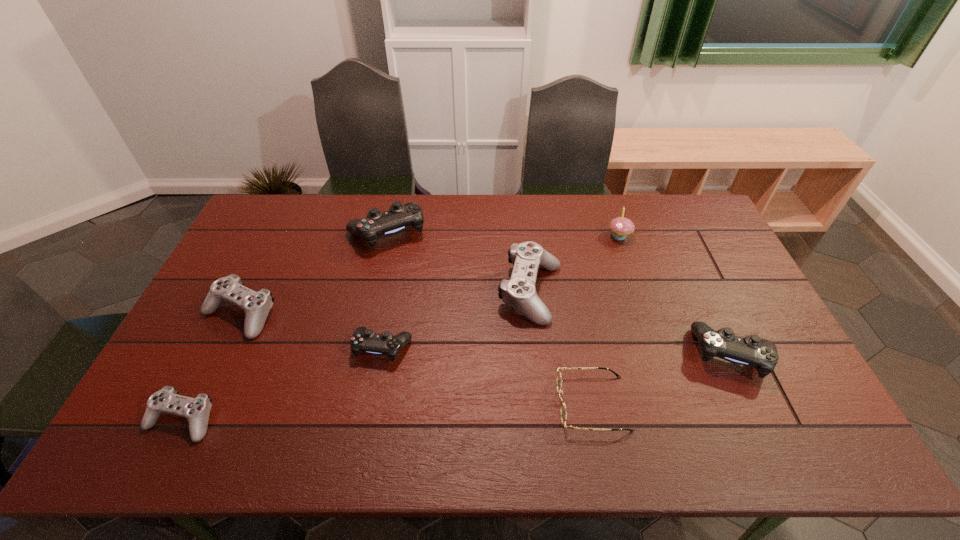
At what (x,y) coordinates should I click in order to perform the action: click on free space between the rightmost control and the second biggest white control. Please return your answer as a coordinate pair (x, y). This screenshot has height=540, width=960. Looking at the image, I should click on (486, 334).

At what (x,y) coordinates should I click in order to perform the action: click on free spot between the biggest black control and the second biggest white control. Please return your answer as a coordinate pair (x, y). Image resolution: width=960 pixels, height=540 pixels. Looking at the image, I should click on (313, 273).

The width and height of the screenshot is (960, 540). Identify the location of free space that is in between the rightmost object and the cupcake. (676, 295).

Find the location of `vacant region between the green spectacles and the cupcake`. vacant region between the green spectacles and the cupcake is located at coordinates (606, 320).

This screenshot has width=960, height=540. Find the location of `empty location between the seventh object from left to right and the green spectacles`. empty location between the seventh object from left to right and the green spectacles is located at coordinates (606, 320).

This screenshot has width=960, height=540. I want to click on object that ranks as the second closest to the tallest control, so click(x=519, y=292).

Locate which object is the sixth closest to the second biggest black control. Please provide its 2D coordinates. Your answer should be formatted as a tuple, i.e. [(x, y)], where the tuple contains the x and y coordinates of a point satisfying the conditions above.

[(256, 305)]

This screenshot has height=540, width=960. Identify the location of the third closest control relative to the second biggest white control. (366, 340).

Locate an element on the screen. The height and width of the screenshot is (540, 960). control that is the third closest one to the rightmost black control is located at coordinates (399, 217).

I want to click on black control object that ranks as the closest to the shortest control, so click(x=366, y=340).